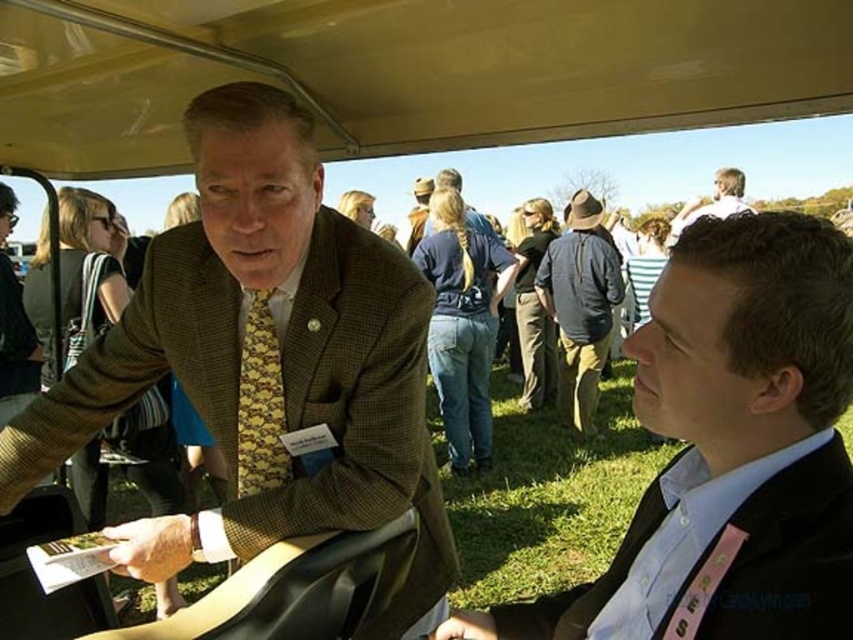
Question: Where is matte brown suit at center located in relation to black satin business suit at lower right in the image?

Choices:
 (A) right
 (B) left

Answer: (B)

Question: Which point is farther to the camera?

Choices:
 (A) matte brown suit at center
 (B) light brown hair at upper right
 (C) yellow patterned tie at center
 (D) denim jacket at center

Answer: (D)

Question: Is matte brown suit at center further to the viewer compared to yellow patterned tie at center?

Choices:
 (A) yes
 (B) no

Answer: (B)

Question: Which object appears closest to the camera in this image?

Choices:
 (A) light brown hair at upper right
 (B) yellow patterned tie at center

Answer: (B)

Question: Which object appears closest to the camera in this image?

Choices:
 (A) denim jacket at center
 (B) matte brown suit at center
 (C) yellow patterned tie at center

Answer: (B)

Question: Is matte brown suit at center in front of matte black suit at center?

Choices:
 (A) no
 (B) yes

Answer: (A)